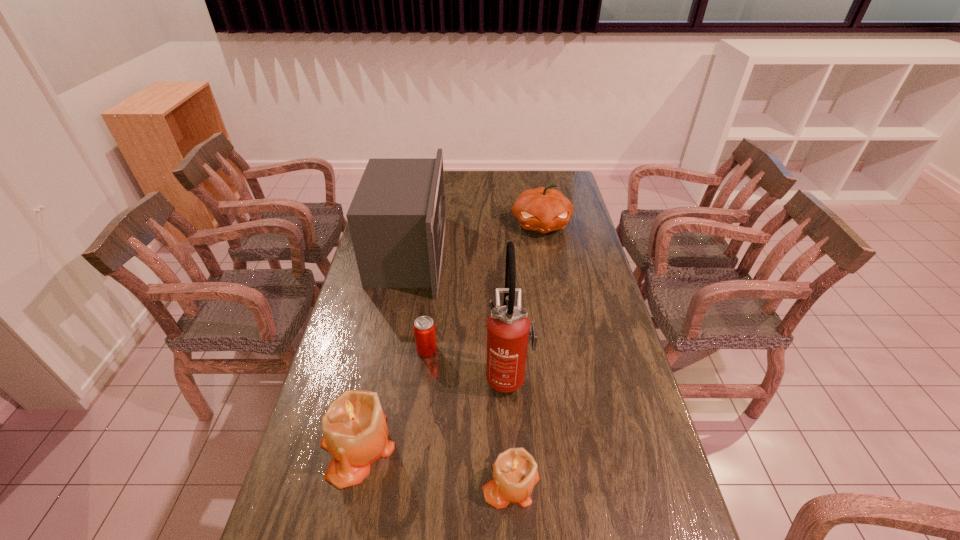
Identify the location of the left candle. The image size is (960, 540). point(355,432).

The width and height of the screenshot is (960, 540). In order to click on the shorter candle in this screenshot , I will do `click(515, 473)`.

Where is `pumpkin`? The image size is (960, 540). pumpkin is located at coordinates (543, 210).

This screenshot has width=960, height=540. In order to click on the second tallest object in this screenshot , I will do point(397,218).

In order to click on the tallest object in this screenshot , I will do [x=508, y=327].

Locate an element on the screen. can is located at coordinates (424, 328).

In order to click on free region located on the back of the taller candle in this screenshot , I will do `click(372, 384)`.

This screenshot has height=540, width=960. Identify the location of vacant space located on the left of the shorter candle. (404, 483).

The image size is (960, 540). Find the location of `free space located 0.280m on the front face of the pumpkin`. free space located 0.280m on the front face of the pumpkin is located at coordinates (553, 288).

At what (x,y) coordinates should I click in order to perform the action: click on free region located on the front-facing side of the fifth shortest object. Please return your answer as a coordinate pair (x, y). The width and height of the screenshot is (960, 540). Looking at the image, I should click on (465, 254).